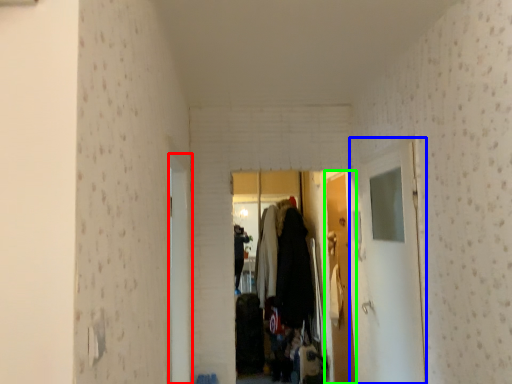
Question: Which object is positioned farthest from door (highlighted by a red box)? Select from glass door (highlighted by a blue box) and door (highlighted by a green box).

Choices:
 (A) glass door
 (B) door

Answer: (B)